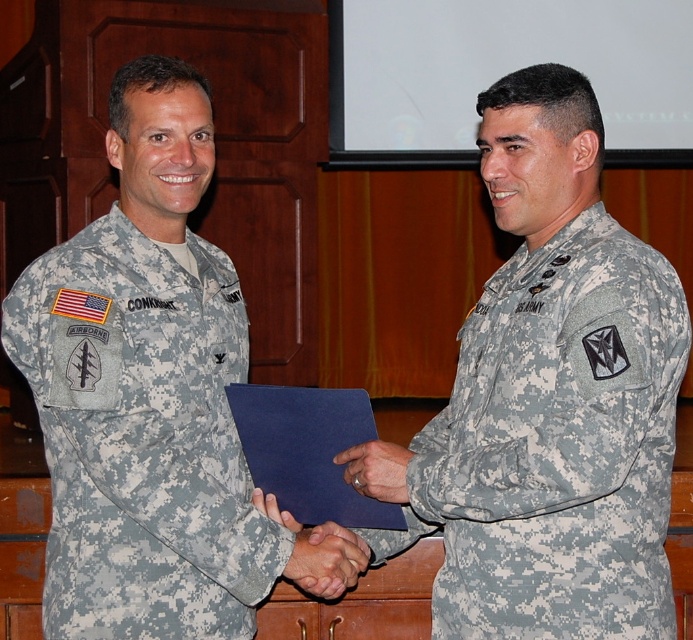
You are a photographer standing in front of the two U.S. Army soldiers. You need to take a photo that includes both of them. Since you want to focus on the soldier in the camouflage fabric uniform at left, where should you position him relative to the camouflage uniform at center?

The camouflage fabric uniform at left is positioned to the left of the camouflage uniform at center. To focus on the camouflage fabric uniform at left, you should position him to the left side of the camouflage uniform at center.

You are an observer looking at the image of two U.S. Army soldiers shaking hands. There are two points marked in the image. The first point is at coordinates point (572, 621) and the second is at point (204, 612). Which of these points is closer to you, the observer?

Point (572, 621) is in front of point (204, 612), so it is closer to you, the observer.